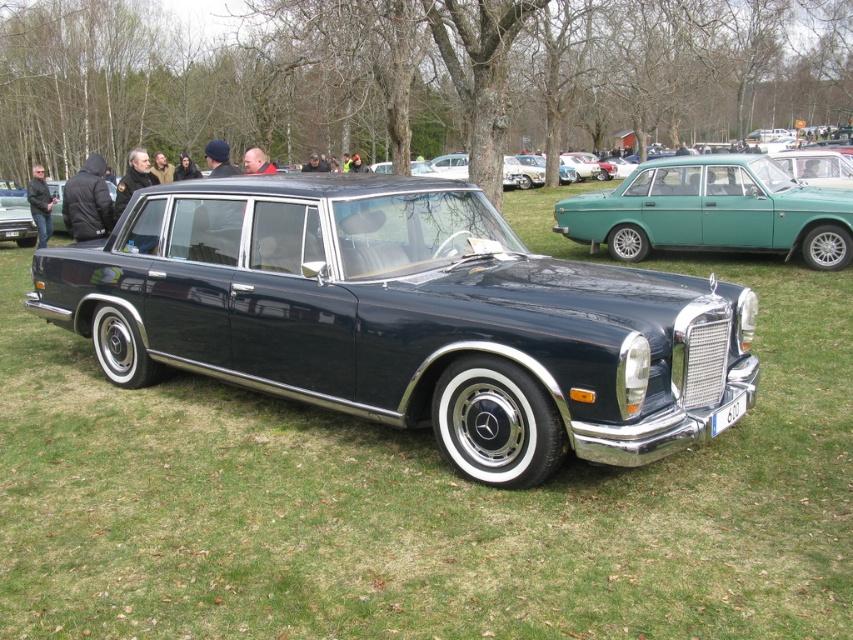
Question: Can you confirm if black jacket at left is positioned below white plastic license plate at lower center?

Choices:
 (A) no
 (B) yes

Answer: (A)

Question: Which object is farther from the camera taking this photo?

Choices:
 (A) shiny dark blue sedan at center
 (B) black jacket at left
 (C) black leather jacket at left

Answer: (C)

Question: Which object is farther from the camera taking this photo?

Choices:
 (A) black jacket at left
 (B) shiny dark blue sedan at center

Answer: (A)

Question: Which point is closer to the camera?

Choices:
 (A) (38, 234)
 (B) (337, 316)

Answer: (B)

Question: In this image, where is black jacket at left located relative to white plastic license plate at lower center?

Choices:
 (A) right
 (B) left

Answer: (B)

Question: Can you confirm if shiny dark blue sedan at center is wider than black leather jacket at left?

Choices:
 (A) yes
 (B) no

Answer: (B)